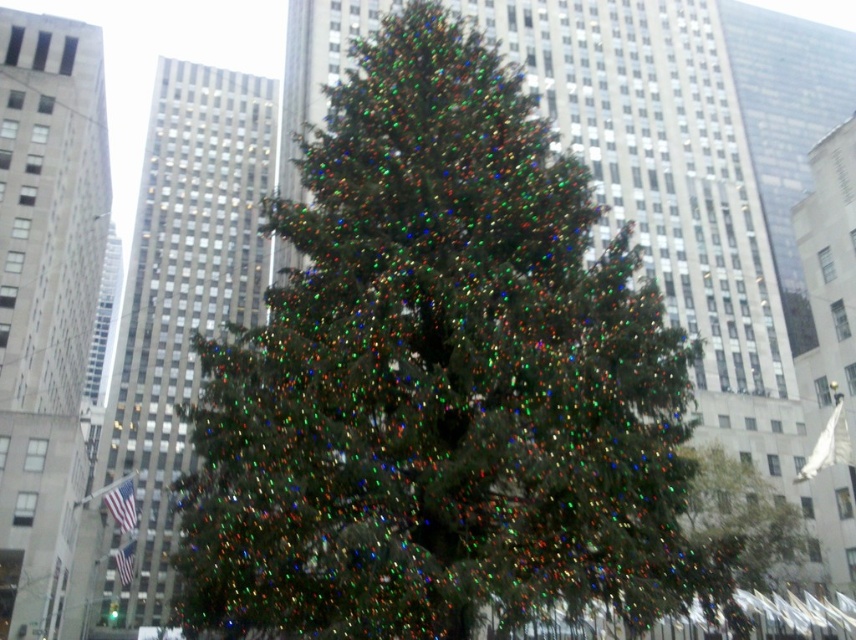
Is iridescent green pine tree at center smaller than green matte tree at center?

No, iridescent green pine tree at center is not smaller than green matte tree at center.

Does iridescent green pine tree at center lie behind green matte tree at center?

No, iridescent green pine tree at center is closer to the viewer.

Who is more distant from viewer, (324,164) or (788,541)?

Positioned behind is point (788,541).

Locate an element on the screen. iridescent green pine tree at center is located at coordinates (438, 380).